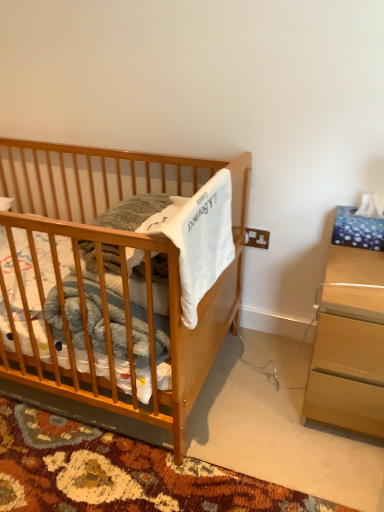
Find the location of a particular element. This screenshot has width=384, height=512. vacant space in front of light brown wood nightstand at right is located at coordinates (323, 473).